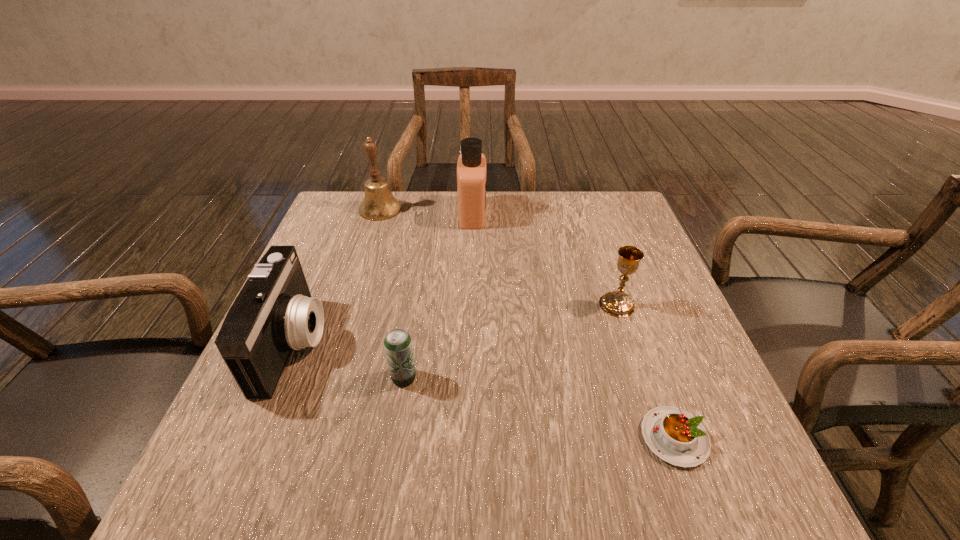
Locate which object ranks in proximity to the third object from right to left. Please provide its 2D coordinates. Your answer should be formatted as a tuple, i.e. [(x, y)], where the tuple contains the x and y coordinates of a point satisfying the conditions above.

[(379, 204)]

Locate an element on the screen. Image resolution: width=960 pixels, height=540 pixels. free space that satisfies the following two spatial constraints: 1. on the lens of the fourth object from right to left; 2. on the left side of the camcorder is located at coordinates (280, 377).

Find the location of a particular element. This screenshot has height=540, width=960. free space that satisfies the following two spatial constraints: 1. on the lens of the beer can; 2. on the left side of the camcorder is located at coordinates (280, 377).

This screenshot has width=960, height=540. Identify the location of vacant position in the image that satisfies the following two spatial constraints: 1. on the lens of the camcorder; 2. on the back side of the beer can. (280, 377).

The image size is (960, 540). In order to click on vacant region that satisfies the following two spatial constraints: 1. on the front label of the perfume; 2. on the back side of the chalice in this screenshot , I will do `click(470, 305)`.

At what (x,y) coordinates should I click in order to perform the action: click on free location that satisfies the following two spatial constraints: 1. on the lens of the camcorder; 2. on the back side of the fifth tallest object. Please return your answer as a coordinate pair (x, y). Looking at the image, I should click on (280, 377).